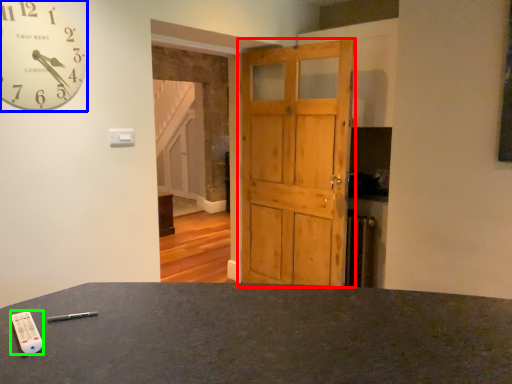
Question: Considering the real-world distances, which object is closest to barn door (highlighted by a red box)? wall clock (highlighted by a blue box) or control (highlighted by a green box).

Choices:
 (A) wall clock
 (B) control

Answer: (A)